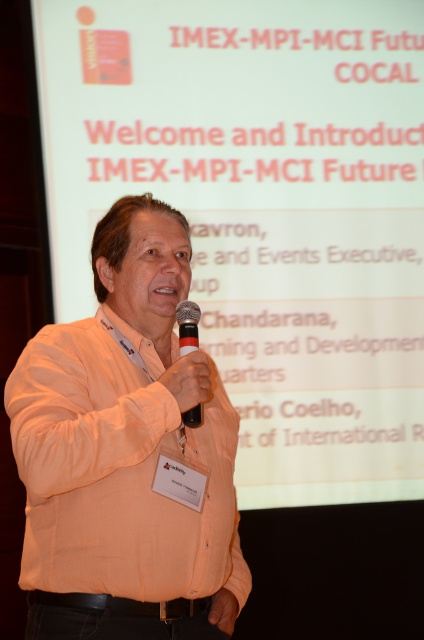
Question: Which point is farther from the camera taking this photo?

Choices:
 (A) (167, 384)
 (B) (189, 417)

Answer: (B)

Question: Can you confirm if orange cotton shirt at center is positioned below black matte microphone at center?

Choices:
 (A) no
 (B) yes

Answer: (B)

Question: Which object is farther from the camera taking this photo?

Choices:
 (A) black matte microphone at center
 (B) orange shirt at center
 (C) orange cotton shirt at center

Answer: (B)

Question: Is the position of orange cotton shirt at center more distant than that of black matte microphone at center?

Choices:
 (A) no
 (B) yes

Answer: (A)

Question: Which point is farther to the camera?

Choices:
 (A) (251, 372)
 (B) (178, 316)

Answer: (A)

Question: Is orange cotton shirt at center to the right of black matte microphone at center from the viewer's perspective?

Choices:
 (A) yes
 (B) no

Answer: (B)